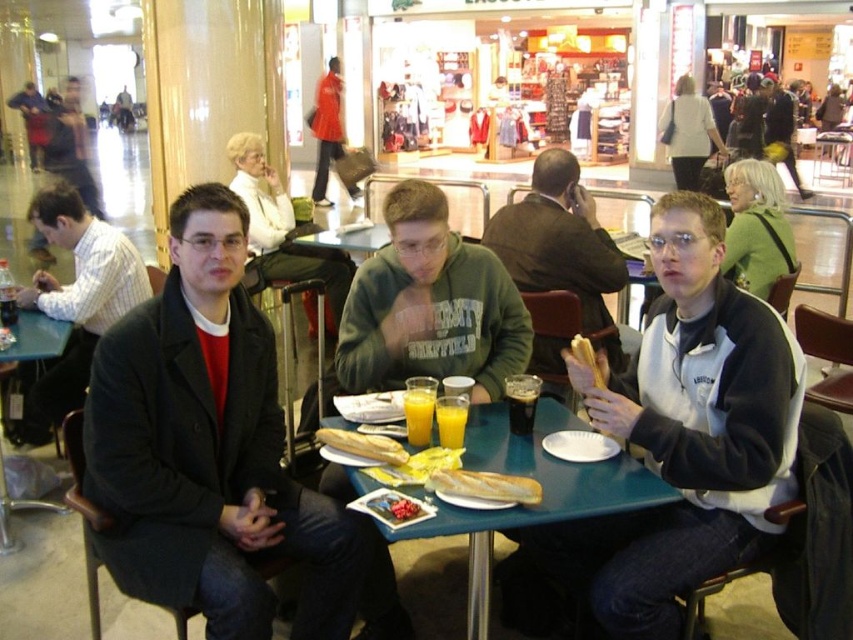
You are a photographer standing at the entrance of the food court. You want to take a photo of the green cotton hoodie at center and the orange liquid glass at table center. Which object is wider in the scene?

The green cotton hoodie at center is wider than the orange liquid glass at table center.

You are a customer at the food court and you want to grab the orange liquid glass at table center without disturbing the man in the green cotton hoodie at center. Can you reach it easily?

The green cotton hoodie at center is above orange liquid glass at table center, so you cannot reach it easily without moving the hoodie or the man wearing it.

You are a photographer standing in the food court. You want to take a photo of the dark gray wool coat at center and the dark glass beverage at table center. Which object should you focus on first if you want to capture both clearly in your shot?

The dark gray wool coat at center is below the dark glass beverage at table center, so you should focus on the dark glass beverage at table center first to ensure both are in focus.